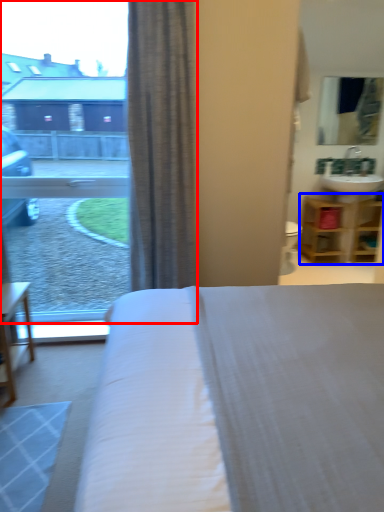
Question: Which point is further to the camera, window (highlighted by a red box) or shelf (highlighted by a blue box)?

Choices:
 (A) window
 (B) shelf

Answer: (B)